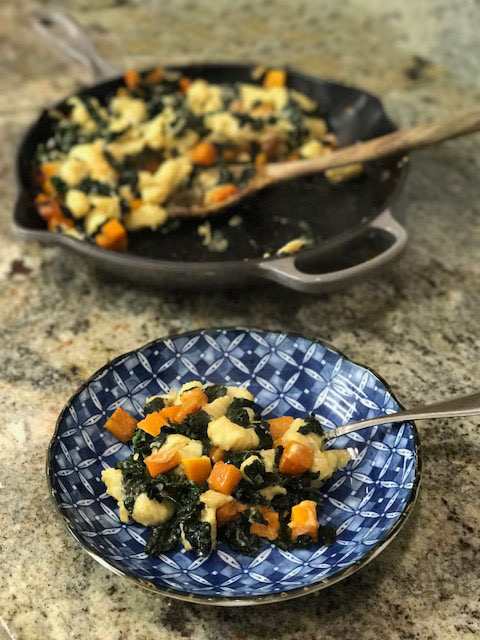
Find the location of a particular element. The width and height of the screenshot is (480, 640). light brown, dark brown and black granite counter is located at coordinates coord(450,580).